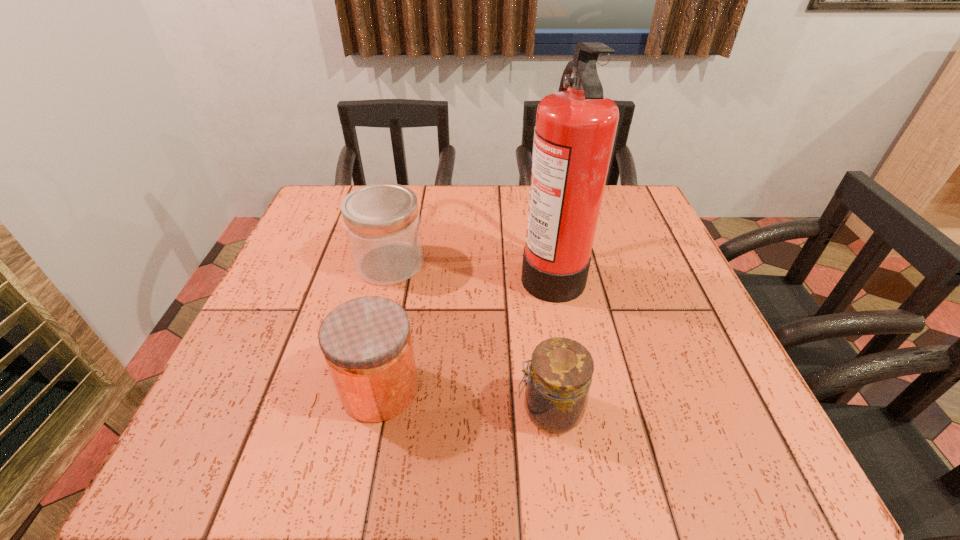
Identify the location of vacant space located 0.180m on the lid of the rightmost jar. Image resolution: width=960 pixels, height=540 pixels. (410, 410).

The width and height of the screenshot is (960, 540). Find the location of `object situated at the far edge`. object situated at the far edge is located at coordinates (575, 130).

Identify the location of vacant space at the far edge. The width and height of the screenshot is (960, 540). (464, 225).

You are a GUI agent. You are given a task and a screenshot of the screen. Output one action in this format:
    pyautogui.click(x=<x>, y=<y>)
    Task: Click on the vacant space at the near edge of the desktop
    The image size is (960, 540).
    Given the screenshot: What is the action you would take?
    pyautogui.click(x=514, y=475)

Image resolution: width=960 pixels, height=540 pixels. I want to click on free space at the left edge of the desktop, so click(x=344, y=259).

Where is `free space at the right edge`? This screenshot has height=540, width=960. free space at the right edge is located at coordinates (620, 250).

Identify the location of free spot at the far left corner of the desktop. (336, 224).

This screenshot has width=960, height=540. Find the location of `blank area at the near right corner`. blank area at the near right corner is located at coordinates (731, 437).

At what (x,y) coordinates should I click in order to perform the action: click on free space that is in between the farthest jar and the tallest object. Please return your answer as a coordinate pair (x, y). Looking at the image, I should click on (470, 267).

Image resolution: width=960 pixels, height=540 pixels. What are the coordinates of `empty location between the farthest jar and the tallest object` in the screenshot? It's located at (470, 267).